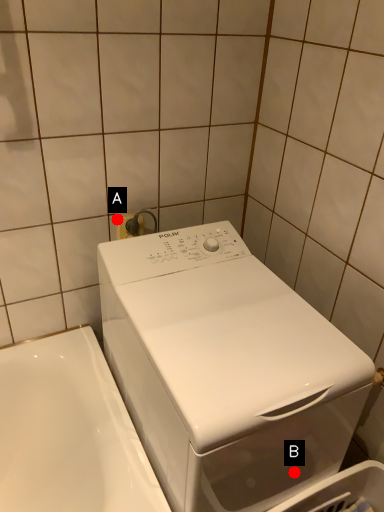
Question: Two points are circled on the image, labeled by A and B beside each circle. Which of the following is the closest to the observer?

Choices:
 (A) A is closer
 (B) B is closer

Answer: (B)